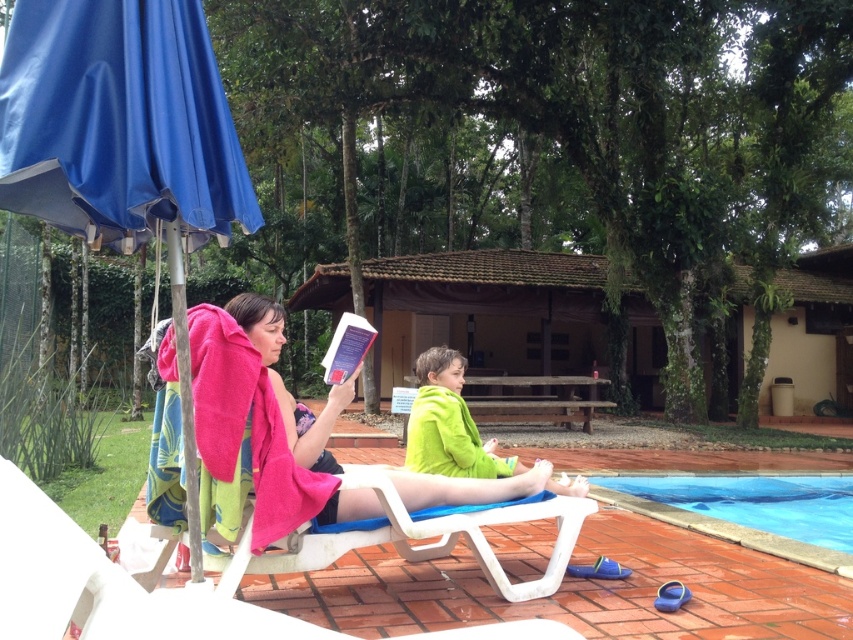
Question: Which object is farther from the camera taking this photo?

Choices:
 (A) green fleece jacket at lower center
 (B) blue smooth water at lower center

Answer: (B)

Question: In this image, where is blue tarpaulin canopy at upper left located relative to blue smooth water at lower center?

Choices:
 (A) above
 (B) below

Answer: (A)

Question: Which of these objects is positioned closest to the pink towel at center?

Choices:
 (A) blue tarpaulin canopy at upper left
 (B) blue fabric umbrella at upper left
 (C) green fleece jacket at lower center

Answer: (C)

Question: Does pink towel at center lie behind blue smooth water at lower center?

Choices:
 (A) no
 (B) yes

Answer: (A)

Question: Which point is farther to the camera?

Choices:
 (A) (810, 531)
 (B) (480, 461)

Answer: (A)

Question: Is blue tarpaulin canopy at upper left below green fleece jacket at lower center?

Choices:
 (A) yes
 (B) no

Answer: (B)